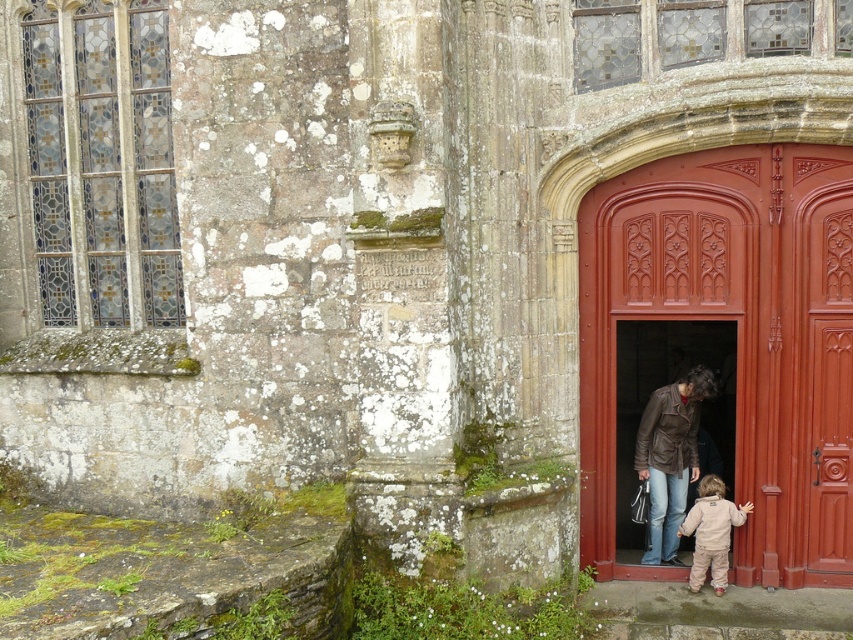
Based on the photo, you are standing in front of an old stone building with a large stained glass window on the left. You notice a brown leather jacket at center. If you want to reach the jacket from your current position, in which direction should you move relative to the stained glass window?

Since the brown leather jacket at center is positioned at point (670, 458), you should move towards the center of the image, which is directly ahead of the stained glass window on the left. Move straight ahead towards the center area where the jacket is located.

You are standing in front of the old stone building and want to enter through the door. There is a light brown fleece jacket at lower right near the entrance. Can you step over the jacket to reach the smooth polished wood door at center right without moving it?

The smooth polished wood door at center right is closer to the viewer than the light brown fleece jacket at lower right, so the door is in front of the jacket. This means the jacket is behind the door and you don not need to step over it to reach the door.